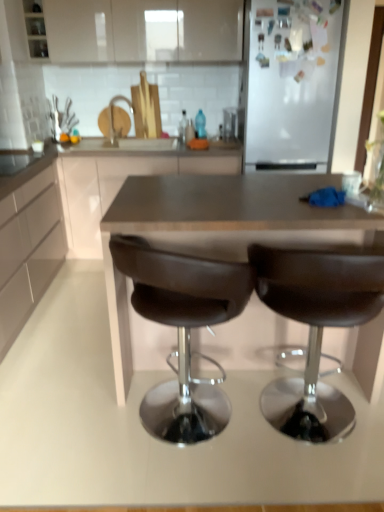
Locate an element on the screen. free space in front of brown leather chair at center, the 2th chair when ordered from left to right is located at coordinates (313, 483).